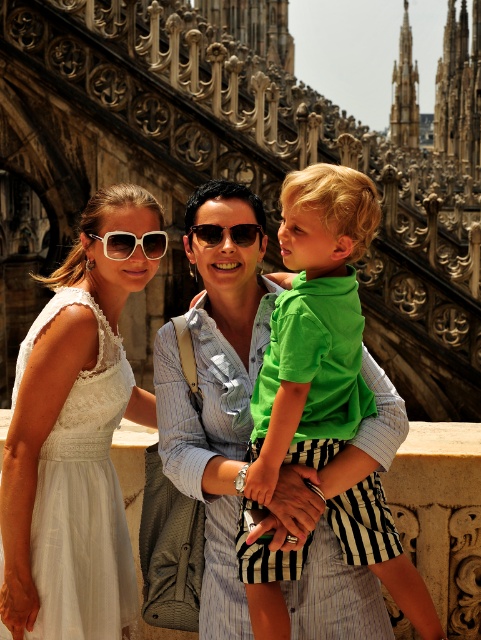
Based on the coordinates provided, which object is located at point (x=75, y=442) in the image?

The white lace dress at center is located at point (x=75, y=442).

In the scene, you see a green matte shirt at center and sunglasses at center. Which object is positioned to the right of the other?

The green matte shirt at center is to the right of sunglasses at center.

You are a photographer trying to capture a group photo of the two adults and the child. You notice the white lace dress at center and the green matte shirt at center. Based on their widths, which clothing item should you position closer to the edge of the frame to avoid overcrowding the composition?

The white lace dress at center might be wider than green matte shirt at center, so positioning the white lace dress at center closer to the edge would help prevent overcrowding as it may take up more space.